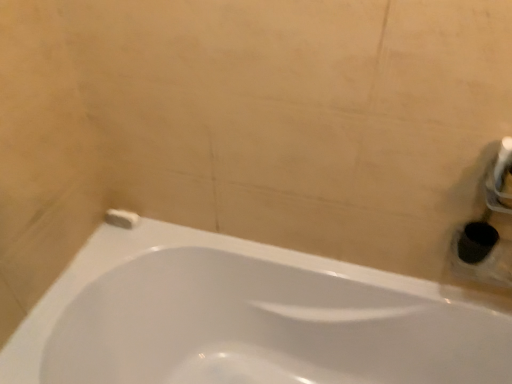
Question: From their relative heights in the image, would you say white glossy bathtub at lower left is taller or shorter than white matte toilet paper at lower left?

Choices:
 (A) tall
 (B) short

Answer: (A)

Question: Is white glossy bathtub at lower left bigger or smaller than white matte toilet paper at lower left?

Choices:
 (A) big
 (B) small

Answer: (A)

Question: Considering their positions, is white glossy bathtub at lower left located in front of or behind white matte toilet paper at lower left?

Choices:
 (A) behind
 (B) front

Answer: (B)

Question: Considering the relative positions of white matte toilet paper at lower left and white glossy bathtub at lower left in the image provided, is white matte toilet paper at lower left to the left or to the right of white glossy bathtub at lower left?

Choices:
 (A) right
 (B) left

Answer: (B)

Question: Would you say white matte toilet paper at lower left is inside or outside white glossy bathtub at lower left?

Choices:
 (A) inside
 (B) outside

Answer: (B)

Question: Is white matte toilet paper at lower left wider or thinner than white glossy bathtub at lower left?

Choices:
 (A) thin
 (B) wide

Answer: (A)

Question: Considering their positions, is white matte toilet paper at lower left located in front of or behind white glossy bathtub at lower left?

Choices:
 (A) behind
 (B) front

Answer: (A)